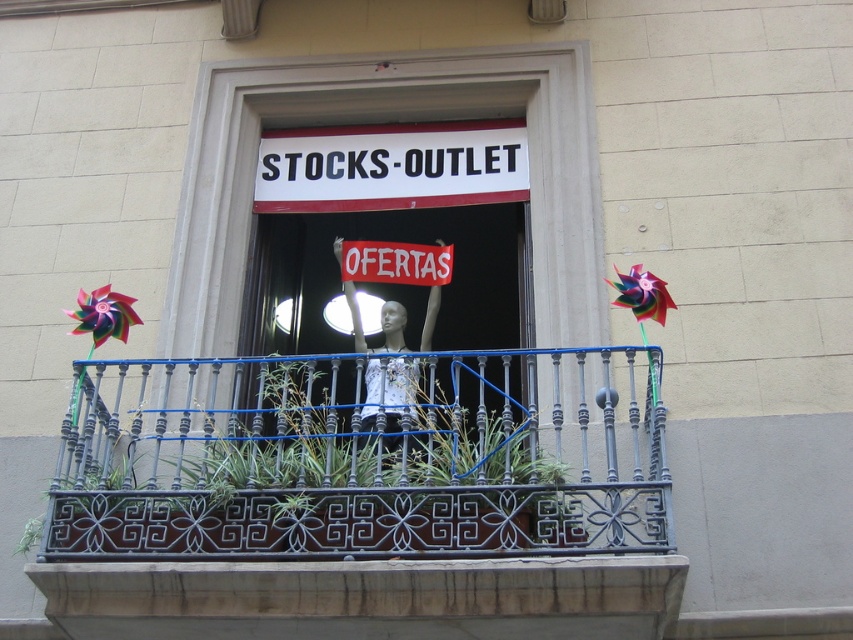
Question: Is dark gray wrought iron at center further to the viewer compared to red fabric sign at center?

Choices:
 (A) no
 (B) yes

Answer: (A)

Question: Does white plastic sign at center appear under white fabric mannequin at center?

Choices:
 (A) yes
 (B) no

Answer: (B)

Question: Which object appears farthest from the camera in this image?

Choices:
 (A) white fabric mannequin at center
 (B) red fabric sign at center
 (C) white plastic sign at center
 (D) dark gray wrought iron at center

Answer: (C)

Question: Which point is closer to the camera?

Choices:
 (A) dark gray wrought iron at center
 (B) red fabric sign at center
 (C) white plastic sign at center

Answer: (A)

Question: Which point is closer to the camera taking this photo?

Choices:
 (A) (344, 285)
 (B) (373, 266)
 (C) (222, 556)
 (D) (339, 198)

Answer: (C)

Question: Considering the relative positions of white plastic sign at center and white fabric mannequin at center in the image provided, where is white plastic sign at center located with respect to white fabric mannequin at center?

Choices:
 (A) above
 (B) below

Answer: (A)